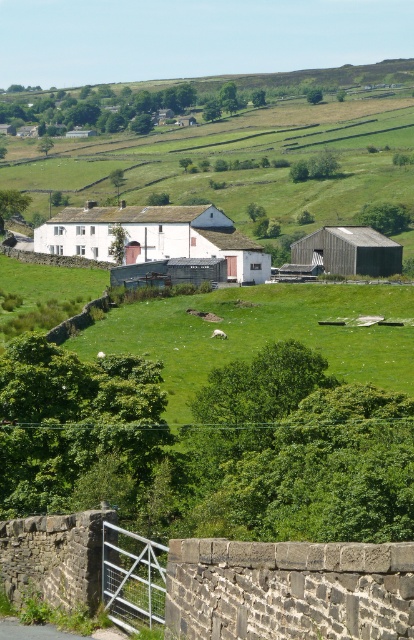
Is white matte barn at center below wooden barn at center?

No, white matte barn at center is not below wooden barn at center.

In the scene shown: Is white matte barn at center shorter than wooden barn at center?

Incorrect, white matte barn at center's height does not fall short of wooden barn at center's.

The height and width of the screenshot is (640, 414). I want to click on white matte barn at center, so click(x=154, y=236).